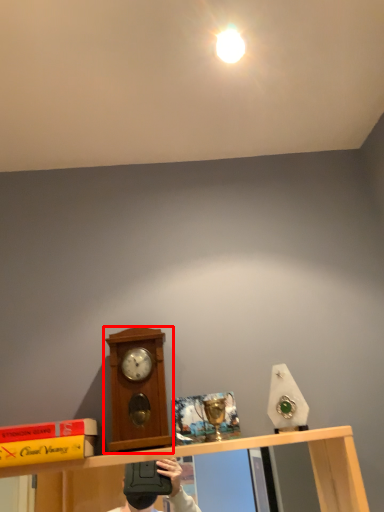
Question: From the image, what is the correct spatial relationship of clock (annotated by the red box) in relation to light?

Choices:
 (A) left
 (B) right

Answer: (A)